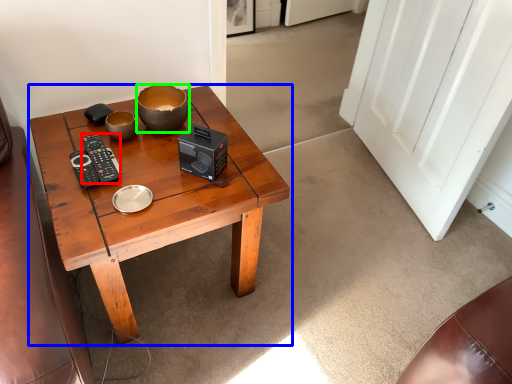
Question: Estimate the real-world distances between objects in this image. Which object is closer to control (highlighted by a red box), coffee table (highlighted by a blue box) or bowl (highlighted by a green box)?

Choices:
 (A) coffee table
 (B) bowl

Answer: (B)